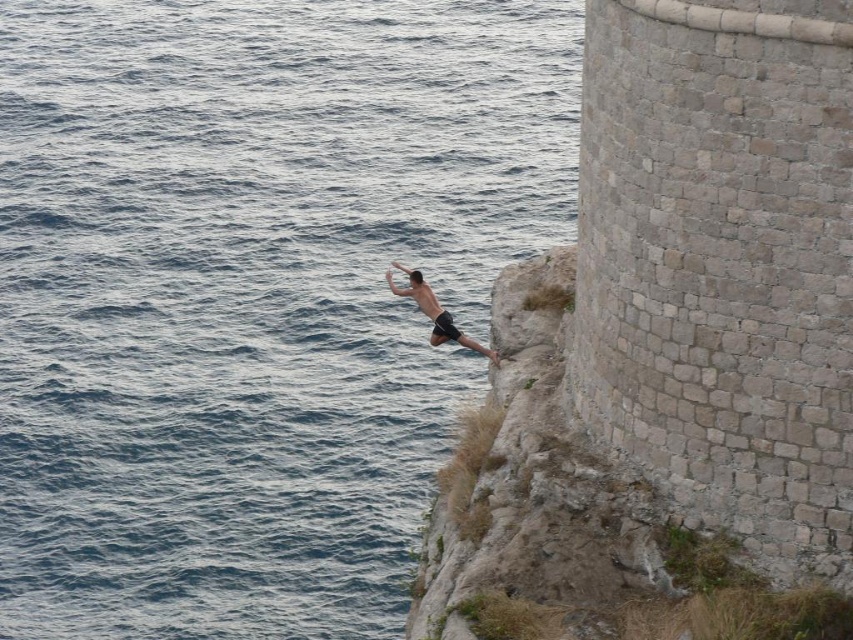
Question: Which point is closer to the camera?

Choices:
 (A) [x=134, y=420]
 (B) [x=405, y=292]

Answer: (B)

Question: Is blue water at left thinner than skinny black shorts at center?

Choices:
 (A) yes
 (B) no

Answer: (B)

Question: Observing the image, what is the correct spatial positioning of blue water at left in reference to skinny black shorts at center?

Choices:
 (A) left
 (B) right

Answer: (A)

Question: Which point is farther from the camera taking this photo?

Choices:
 (A) click(189, 467)
 (B) click(418, 305)

Answer: (A)

Question: Does blue water at left appear on the right side of skinny black shorts at center?

Choices:
 (A) yes
 (B) no

Answer: (B)